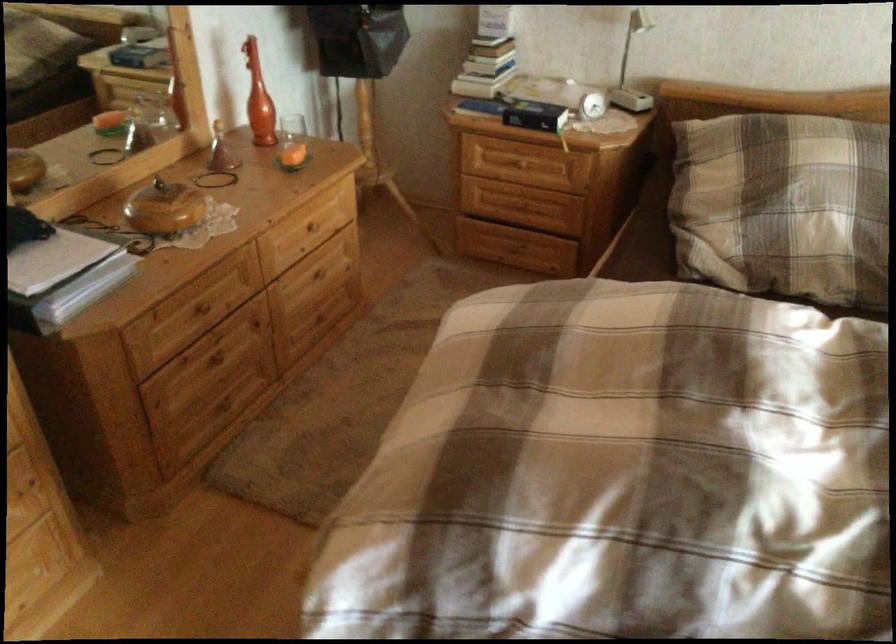
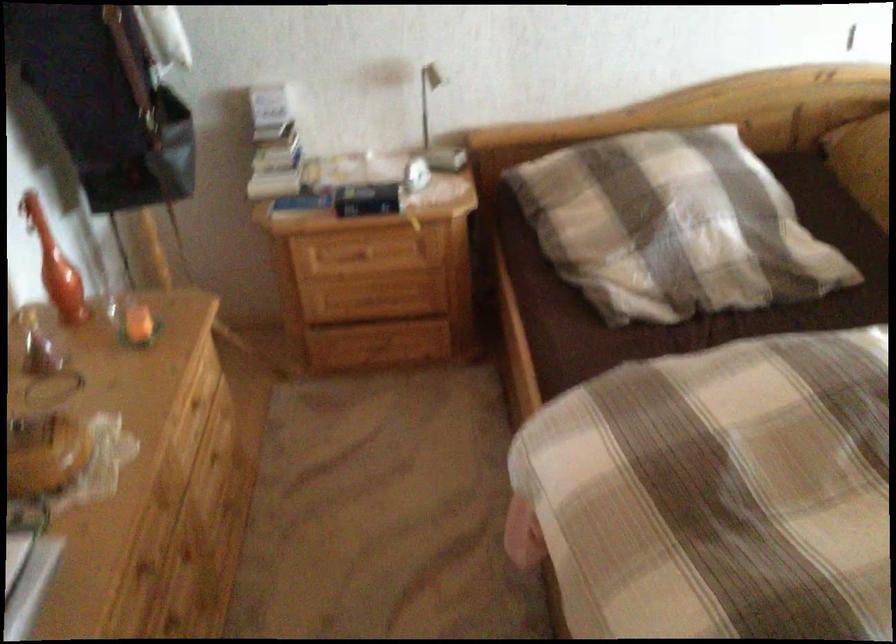
In the second image, find the point that corresponds to pixel 260 93 in the first image.

(55, 265)